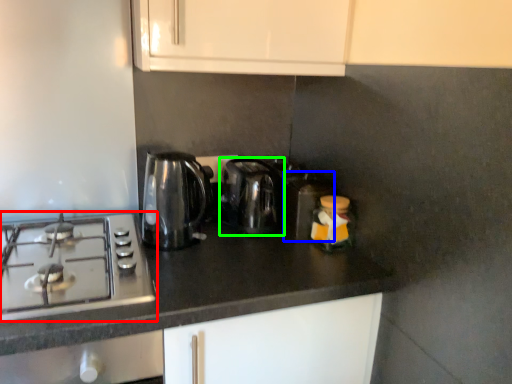
Question: Considering the real-world distances, which object is closest to gas stove (highlighted by a red box)? appliance (highlighted by a blue box) or kitchen appliance (highlighted by a green box).

Choices:
 (A) appliance
 (B) kitchen appliance

Answer: (B)